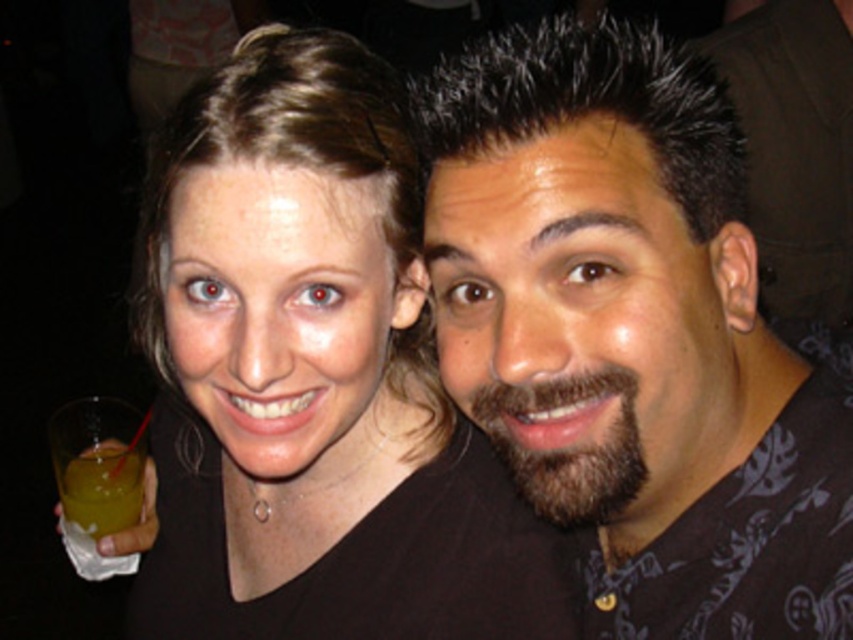
You are a photographer trying to focus on the matte black shirt at center and the translucent yellow liquid at lower left. Which object should you adjust your camera to focus on first if you want to capture both in sharp detail?

The translucent yellow liquid at lower left should be focused on first because the matte black shirt at center is positioned on the right side of it, meaning it is further away from the camera. By focusing on the closer object, the background object will also be in focus due to depth of field.

Based on the scene description, where is the dark brown hair at center in relation to the matte black shirt at center?

The dark brown hair at center is to the right of the matte black shirt at center.